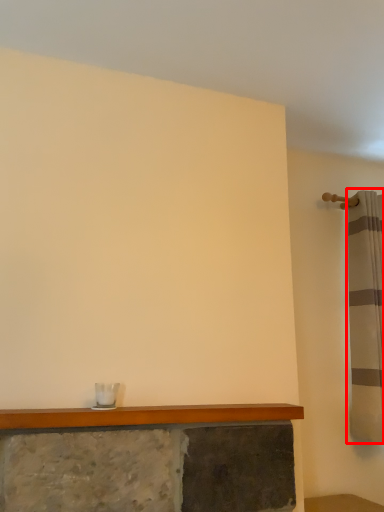
Question: From the image's perspective, what is the correct spatial positioning of shower curtain (annotated by the red box) in reference to counter top?

Choices:
 (A) below
 (B) above

Answer: (B)